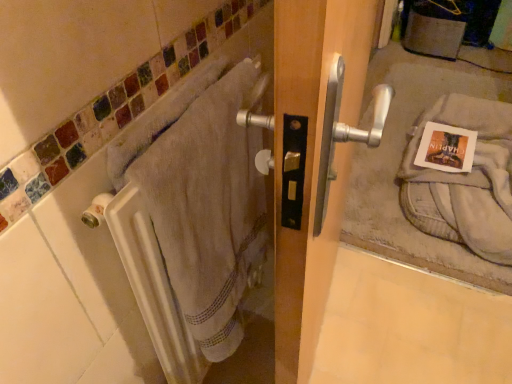
Question: Could you tell me if beige cotton towel at left, acting as the second bath towel starting from the right, is turned towards white towel at left?

Choices:
 (A) yes
 (B) no

Answer: (A)

Question: Considering the relative sizes of beige cotton towel at left, arranged as the first bath towel when viewed from the left, and white towel at left in the image provided, is beige cotton towel at left, arranged as the first bath towel when viewed from the left, bigger than white towel at left?

Choices:
 (A) no
 (B) yes

Answer: (B)

Question: Is beige cotton towel at left, arranged as the first bath towel when viewed from the left, not close to white towel at left?

Choices:
 (A) no
 (B) yes

Answer: (A)

Question: Is beige cotton towel at left, acting as the second bath towel starting from the right, not within white towel at left?

Choices:
 (A) yes
 (B) no

Answer: (A)

Question: Is beige cotton towel at left, acting as the second bath towel starting from the right, facing away from white towel at left?

Choices:
 (A) yes
 (B) no

Answer: (A)

Question: In terms of height, does white towel at left look taller or shorter compared to matte paper postcard at door handle?

Choices:
 (A) tall
 (B) short

Answer: (A)

Question: Visually, is white towel at left positioned to the left or to the right of matte paper postcard at door handle?

Choices:
 (A) right
 (B) left

Answer: (B)

Question: Considering the positions of white towel at left and matte paper postcard at door handle in the image, is white towel at left bigger or smaller than matte paper postcard at door handle?

Choices:
 (A) big
 (B) small

Answer: (A)

Question: From the image's perspective, is white towel at left positioned above or below matte paper postcard at door handle?

Choices:
 (A) above
 (B) below

Answer: (B)

Question: In the image, is beige cotton towel at left, which is the first bath towel from front to back, on the left side or the right side of gray cotton towel at lower right, the 1th bath towel from the back?

Choices:
 (A) left
 (B) right

Answer: (A)

Question: Is beige cotton towel at left, acting as the second bath towel starting from the right, inside the boundaries of gray cotton towel at lower right, placed as the 2th bath towel when sorted from left to right, or outside?

Choices:
 (A) inside
 (B) outside

Answer: (B)

Question: Considering the positions of point 202,327 and point 415,168, is point 202,327 closer or farther from the camera than point 415,168?

Choices:
 (A) farther
 (B) closer

Answer: (B)

Question: In terms of size, does beige cotton towel at left, acting as the second bath towel starting from the right, appear bigger or smaller than gray cotton towel at lower right, which is the first bath towel from right to left?

Choices:
 (A) small
 (B) big

Answer: (A)

Question: From a real-world perspective, relative to white towel at left, is matte paper postcard at door handle vertically above or below?

Choices:
 (A) below
 (B) above

Answer: (A)

Question: Does point (457, 129) appear closer or farther from the camera than point (84, 160)?

Choices:
 (A) closer
 (B) farther

Answer: (B)